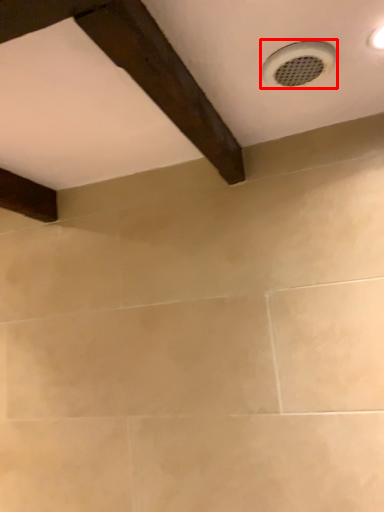
Question: Observing the image, what is the correct spatial positioning of plumbing fixture (annotated by the red box) in reference to exhaust hood?

Choices:
 (A) right
 (B) left

Answer: (A)